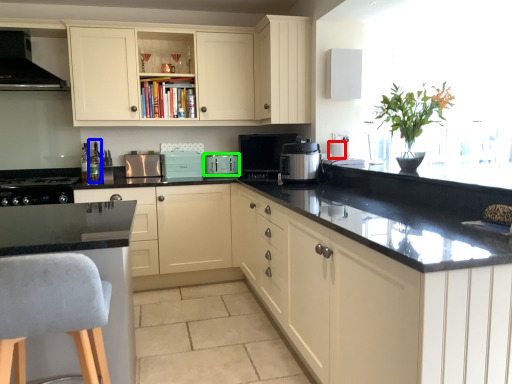
Question: Which is farther away from appliance (highlighted by a red box)? bottle (highlighted by a blue box) or kitchen appliance (highlighted by a green box)?

Choices:
 (A) bottle
 (B) kitchen appliance

Answer: (A)